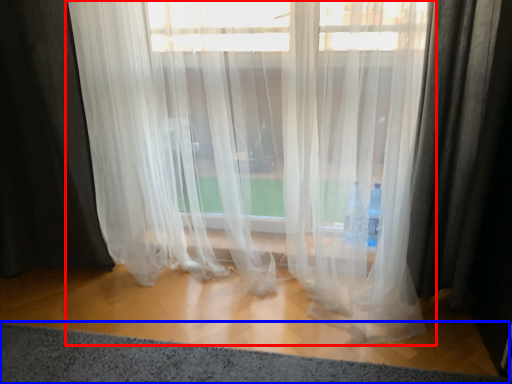
Question: Which of the following is the farthest to the observer, curtain (highlighted by a red box) or doormat (highlighted by a blue box)?

Choices:
 (A) curtain
 (B) doormat

Answer: (A)